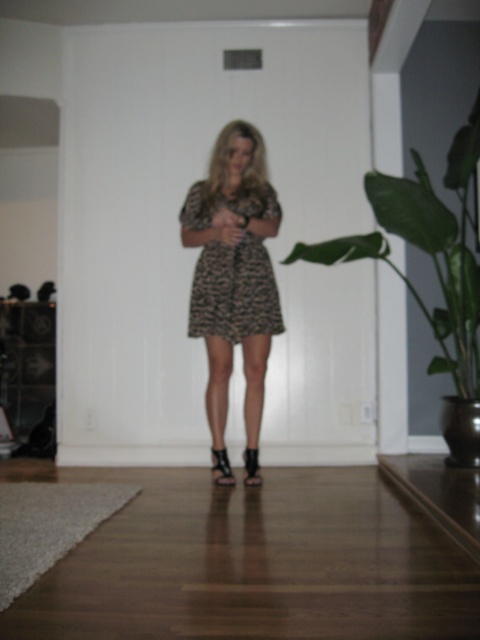
Is point (251, 280) less distant than point (251, 202)?

Yes, point (251, 280) is closer to viewer.

How far apart are leopard print dress at center and leopard print fabric dress at center?

2.38 inches

Describe the element at coordinates (233, 282) in the screenshot. I see `leopard print dress at center` at that location.

Locate an element on the screen. This screenshot has height=640, width=480. leopard print dress at center is located at coordinates (233, 282).

Looking at this image, who is shorter, green leafy plant at center right or leopard print fabric dress at center?

leopard print fabric dress at center is shorter.

At what (x,y) coordinates should I click in order to perform the action: click on green leafy plant at center right. Please return your answer as a coordinate pair (x, y). The width and height of the screenshot is (480, 640). Looking at the image, I should click on (427, 250).

Image resolution: width=480 pixels, height=640 pixels. Find the location of `green leafy plant at center right`. green leafy plant at center right is located at coordinates (427, 250).

Is leopard print dress at center taller than green leafy plant at center right?

Yes, leopard print dress at center is taller than green leafy plant at center right.

You are a GUI agent. You are given a task and a screenshot of the screen. Output one action in this format:
    pyautogui.click(x=<x>, y=<y>)
    Task: Click on the leopard print dress at center
    The width and height of the screenshot is (480, 640).
    Given the screenshot: What is the action you would take?
    pyautogui.click(x=233, y=282)